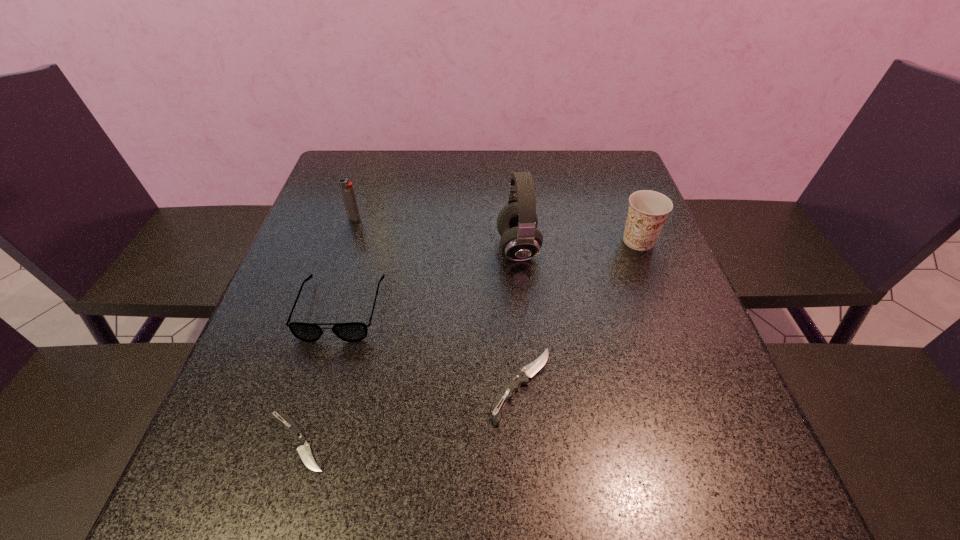
Locate an element on the screen. This screenshot has height=540, width=960. the shortest object is located at coordinates [303, 448].

The width and height of the screenshot is (960, 540). Find the location of `the left pocketknife`. the left pocketknife is located at coordinates (303, 448).

The image size is (960, 540). In order to click on the taller pocketknife in this screenshot , I will do `click(522, 377)`.

At what (x,y) coordinates should I click in order to perform the action: click on the right pocketknife. Please return your answer as a coordinate pair (x, y). The width and height of the screenshot is (960, 540). Looking at the image, I should click on (522, 377).

Locate an element on the screen. Image resolution: width=960 pixels, height=540 pixels. igniter is located at coordinates (347, 190).

At what (x,y) coordinates should I click in order to perform the action: click on headset. Please return your answer as a coordinate pair (x, y). The width and height of the screenshot is (960, 540). Looking at the image, I should click on (517, 222).

Locate an element on the screen. The width and height of the screenshot is (960, 540). Dixie cup is located at coordinates (648, 210).

Image resolution: width=960 pixels, height=540 pixels. In order to click on the third shortest object in this screenshot , I will do `click(353, 331)`.

I want to click on the fourth farthest object, so click(353, 331).

Find the location of a particular element. This screenshot has width=960, height=540. vacant region located on the right of the shortest object is located at coordinates (502, 442).